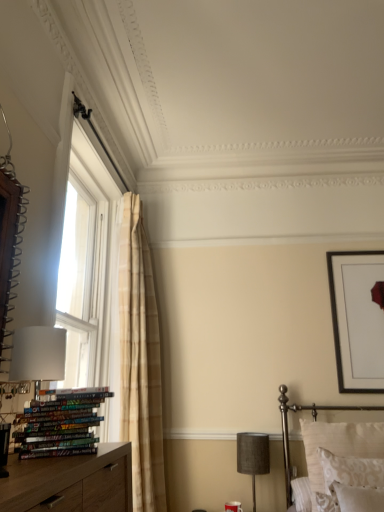
Question: Is black matte picture frame at upper right inside or outside of multicolored glossy books at lower left?

Choices:
 (A) outside
 (B) inside

Answer: (A)

Question: From a real-world perspective, is black matte picture frame at upper right positioned above or below multicolored glossy books at lower left?

Choices:
 (A) below
 (B) above

Answer: (B)

Question: Which is nearer to the black matte picture frame at upper right?

Choices:
 (A) white matte table lamp at left, acting as the 1th table lamp starting from the top
 (B) patterned fabric pillow at lower right
 (C) textured gray lampshade at lower right, the 2th table lamp when ordered from left to right
 (D) white textured pillows at lower right
 (E) multicolored glossy books at lower left

Answer: (D)

Question: Estimate the real-world distances between objects in this image. Which object is closer to the multicolored glossy books at lower left?

Choices:
 (A) white textured pillows at lower right
 (B) patterned fabric pillow at lower right
 (C) white matte table lamp at left, marked as the 2th table lamp in a right-to-left arrangement
 (D) textured gray lampshade at lower right, arranged as the 2th table lamp when viewed from the top
 (E) black matte picture frame at upper right

Answer: (C)